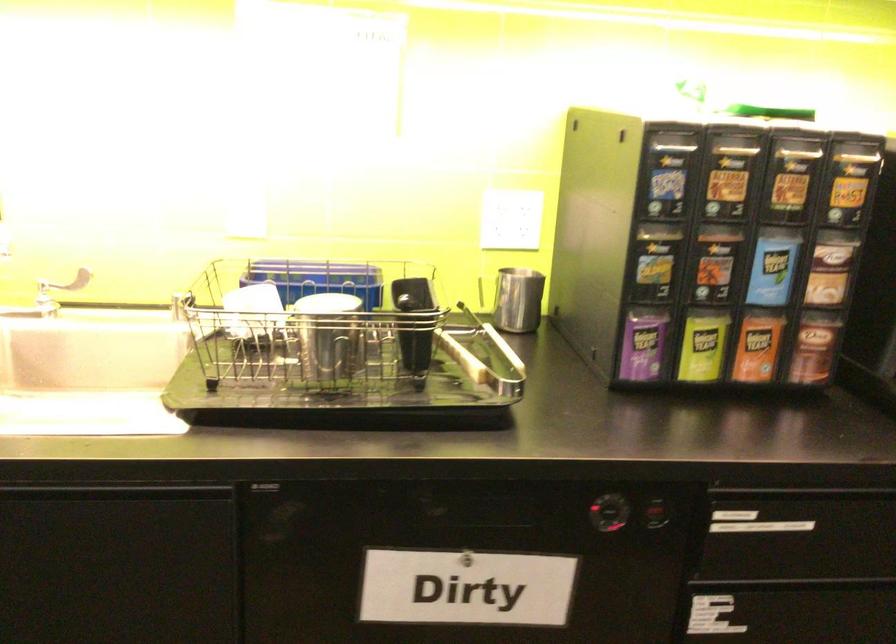
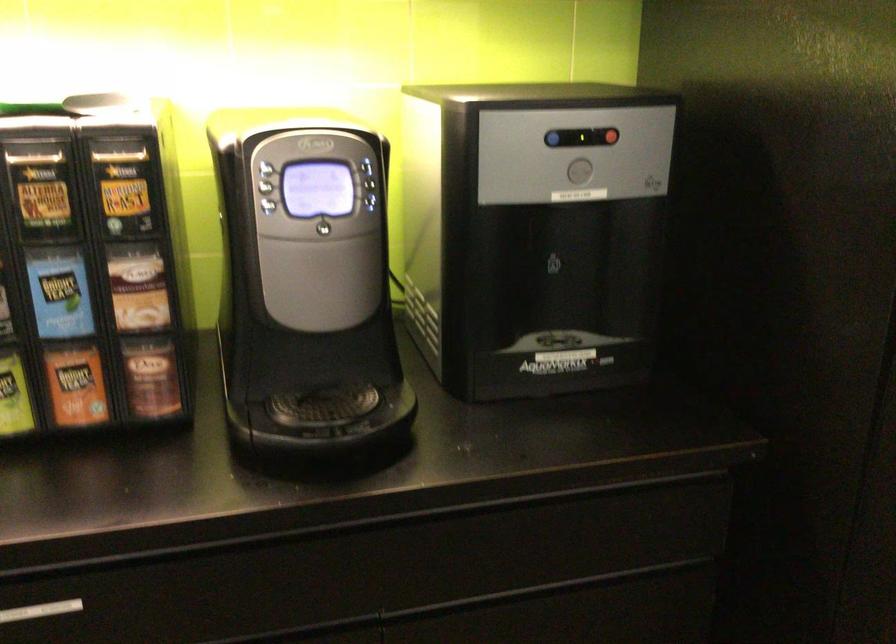
In the second image, find the point that corresponds to the point at 772,267 in the first image.

(58, 292)